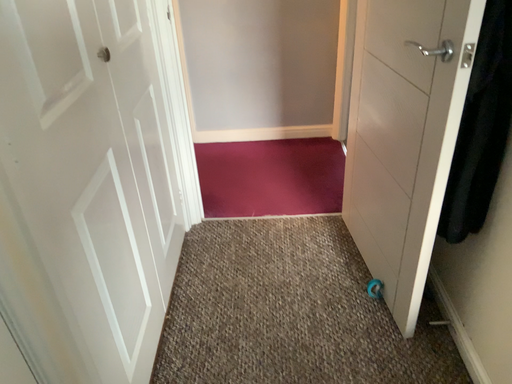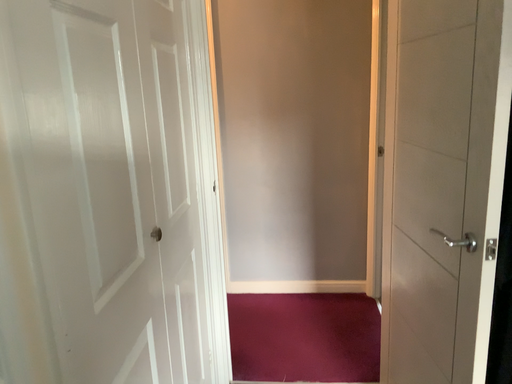
Question: How did the camera likely rotate when shooting the video?

Choices:
 (A) rotated downward
 (B) rotated upward

Answer: (B)